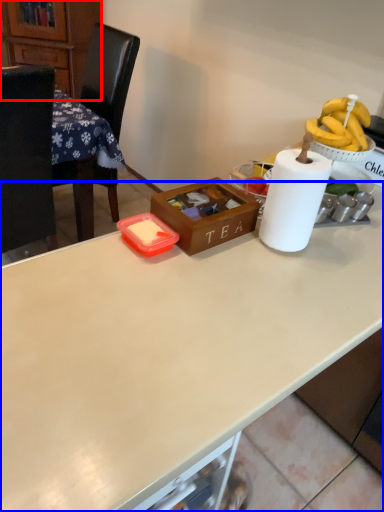
Question: Which object appears closest to the camera in this image, cabinetry (highlighted by a red box) or desk (highlighted by a blue box)?

Choices:
 (A) cabinetry
 (B) desk

Answer: (B)